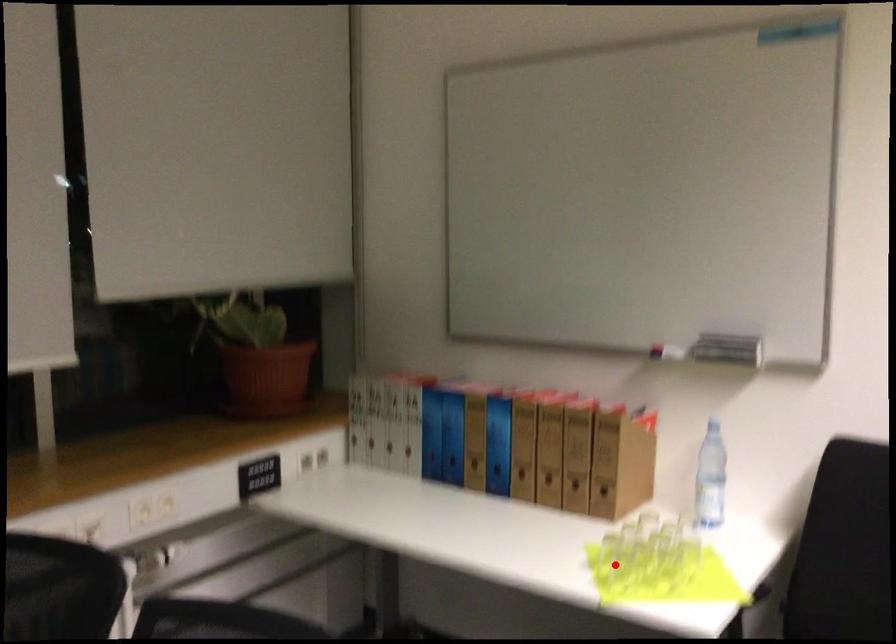
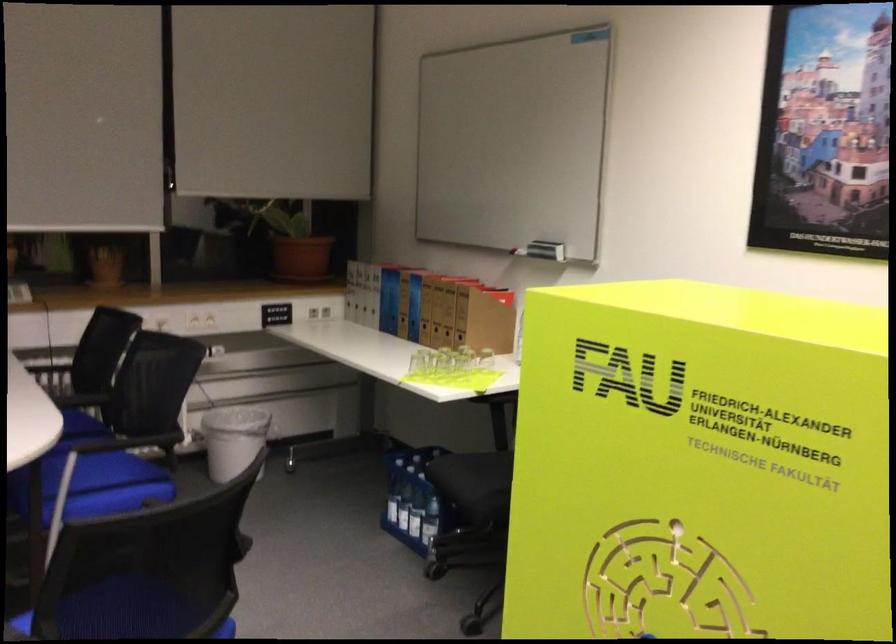
In the second image, find the point that corresponds to the highlighted location in the first image.

(418, 363)